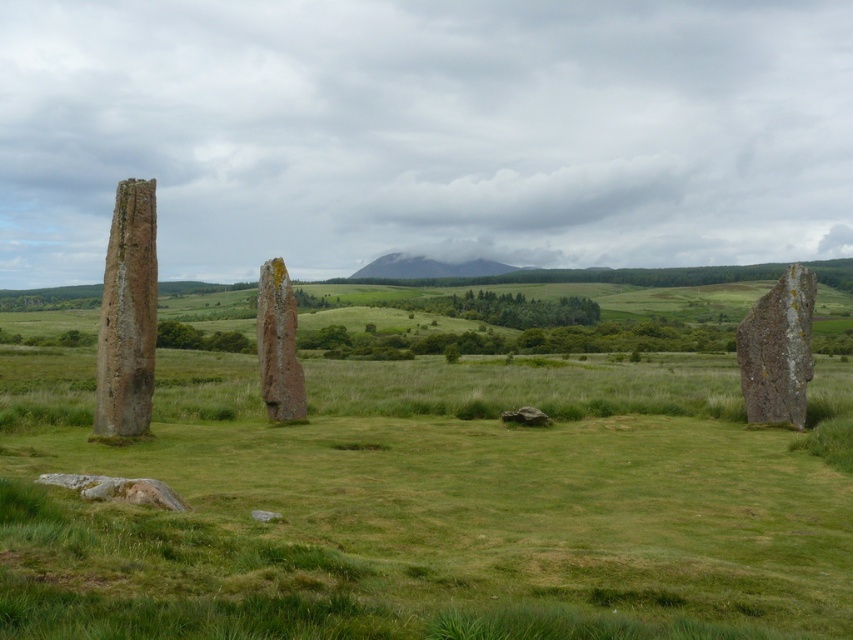
Question: Which point is closer to the camera taking this photo?

Choices:
 (A) [x=126, y=236]
 (B) [x=752, y=317]
 (C) [x=271, y=401]

Answer: (A)

Question: Can you confirm if rustic stone pillar at left is thinner than rusty stone pillar at center?

Choices:
 (A) yes
 (B) no

Answer: (B)

Question: Can you confirm if rustic stone pillar at left is positioned to the right of smooth gray stone at right?

Choices:
 (A) no
 (B) yes

Answer: (A)

Question: Estimate the real-world distances between objects in this image. Which object is farther from the rustic stone pillar at left?

Choices:
 (A) smooth gray stone at right
 (B) rusty stone pillar at center

Answer: (A)

Question: Can you confirm if rustic stone pillar at left is positioned above smooth gray stone at right?

Choices:
 (A) yes
 (B) no

Answer: (A)

Question: Which of the following is the closest to the observer?

Choices:
 (A) (107, 422)
 (B) (779, 312)

Answer: (A)